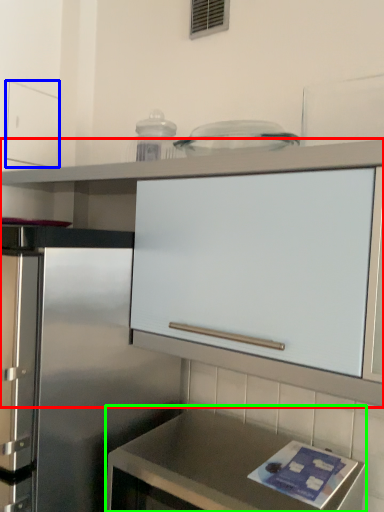
Question: Based on their relative distances, which object is farther from cabinetry (highlighted by a red box)? Choose from drawer (highlighted by a blue box) and countertop (highlighted by a green box).

Choices:
 (A) drawer
 (B) countertop

Answer: (B)